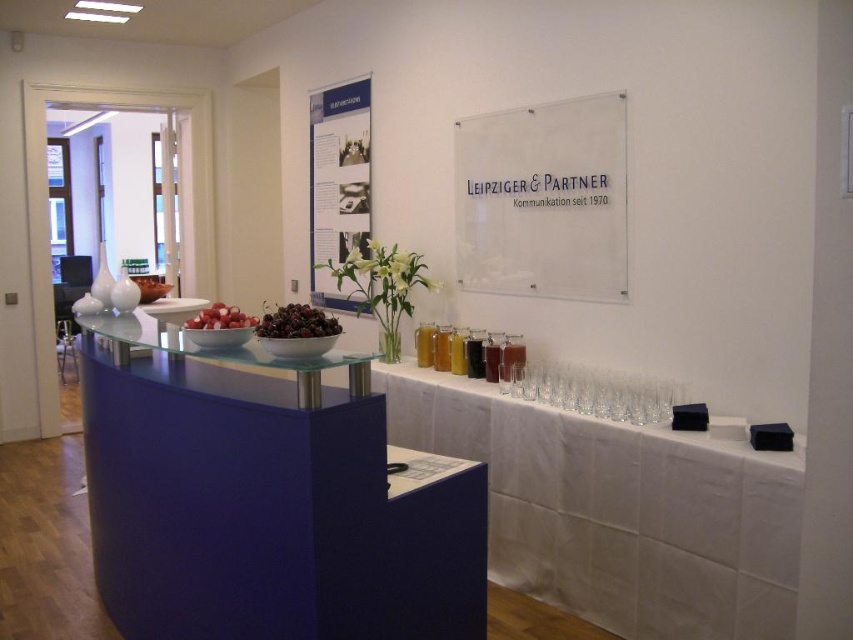
You are organizing a small event and need to place a 15 cm wide decorative item. You have access to the white fabric at lower right and the red matte radish at center. Which object can accommodate the item if placed on top?

The white fabric at lower right might be wider than red matte radish at center, so it can accommodate the 15 cm wide decorative item.

You are standing in front of the reception counter and need to place a new item on the counter. There are two specific points marked on the counter where you can place it. Which point is closer to you, point (316, 540) or point (570, 225)?

Point (316, 540) is closer to the camera than point (570, 225). Since you are standing in front of the counter, the point closer to the camera would be the one closer to you. Therefore, point (316, 540) is closer to you.